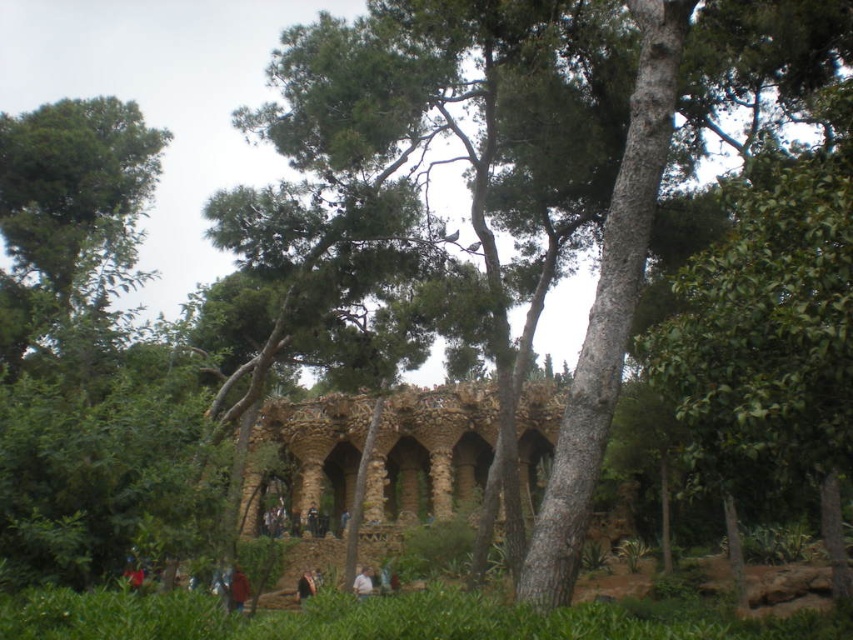
Does light brown leather jacket at lower center have a lesser width compared to brown leather jacket at lower center?

Yes.

Who is positioned more to the right, light brown leather jacket at lower center or brown leather jacket at lower center?

light brown leather jacket at lower center

What are the coordinates of `light brown leather jacket at lower center` in the screenshot? It's located at (363, 582).

Who is taller, light brown leather jacket at lower center or dark brown leather jacket at center?

dark brown leather jacket at center is taller.

Who is shorter, light brown leather jacket at lower center or dark brown leather jacket at center?

light brown leather jacket at lower center

Identify the location of light brown leather jacket at lower center. The height and width of the screenshot is (640, 853). (363, 582).

Does point (228, 609) lie in front of point (305, 588)?

Yes, it is.

Is red fabric person at lower center to the right of brown leather jacket at lower center from the viewer's perspective?

No, red fabric person at lower center is not to the right of brown leather jacket at lower center.

Between point (230, 576) and point (297, 589), which one is positioned in front?

Point (230, 576) is more forward.

At what (x,y) coordinates should I click in order to perform the action: click on red fabric person at lower center. Please return your answer as a coordinate pair (x, y). Looking at the image, I should click on (236, 588).